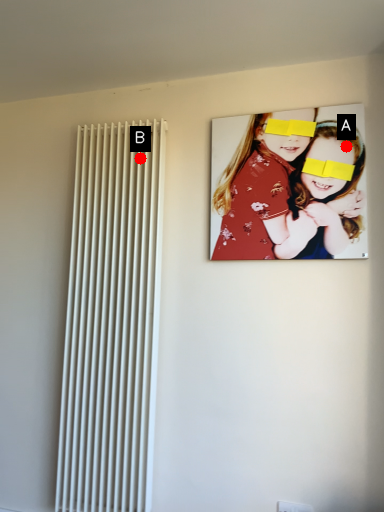
Question: Two points are circled on the image, labeled by A and B beside each circle. Which point is closer to the camera?

Choices:
 (A) A is closer
 (B) B is closer

Answer: (A)